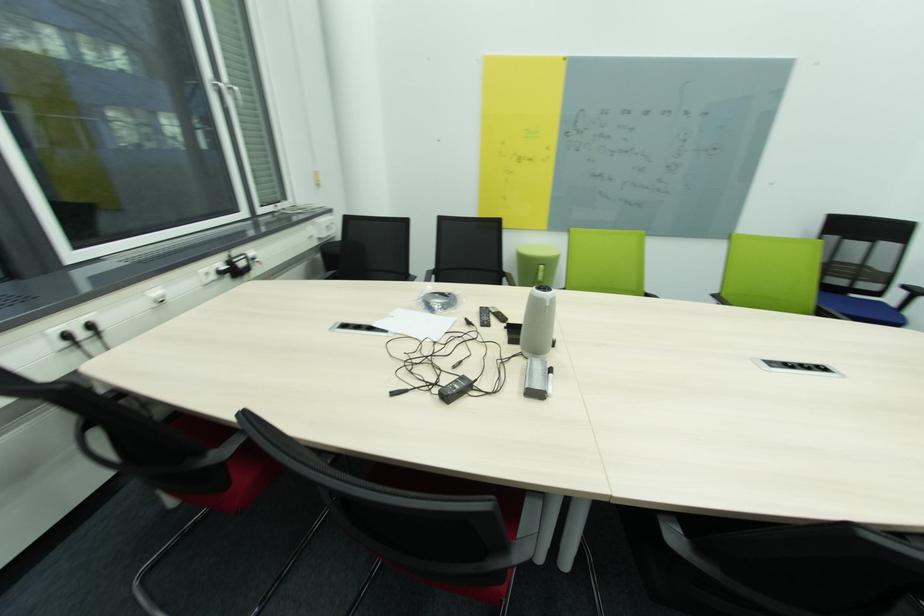
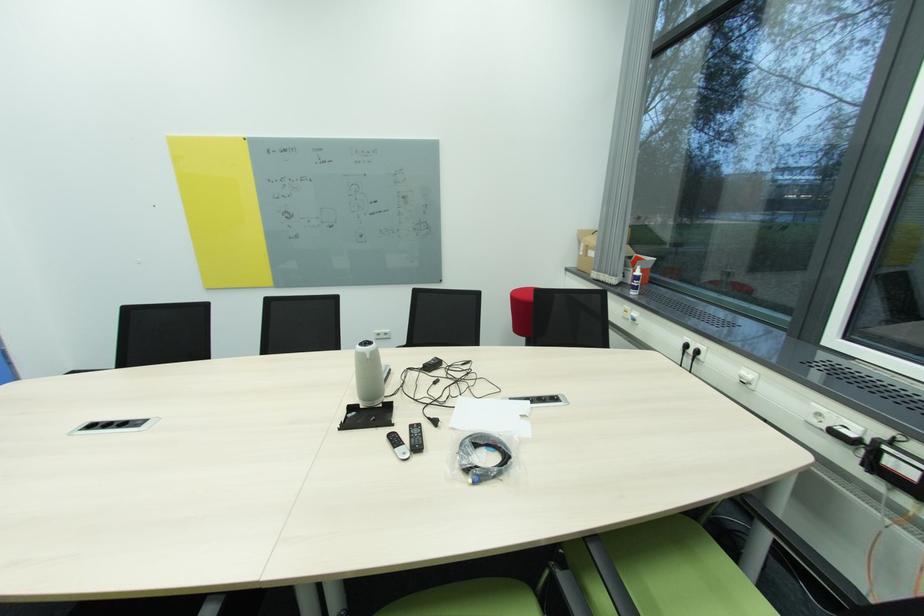
The point at [478,326] is marked in the first image. Where is the corresponding point in the second image?

(433, 419)